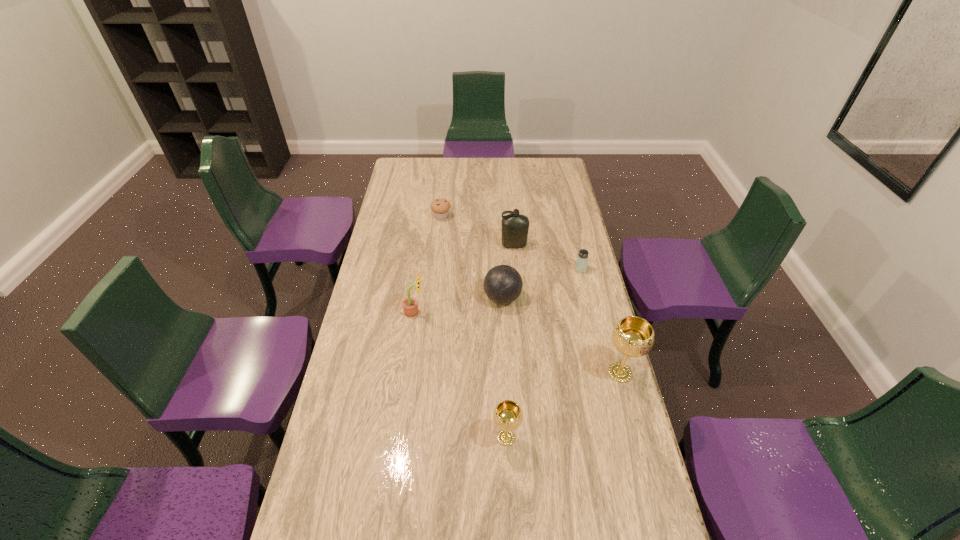
This screenshot has width=960, height=540. What are the coordinates of `vacant space at the far edge of the desktop` in the screenshot? It's located at (435, 167).

In the image, there is a desktop. Identify the location of free space at the left edge. (392, 369).

This screenshot has height=540, width=960. I want to click on vacant space at the right edge of the desktop, so click(593, 346).

The height and width of the screenshot is (540, 960). I want to click on free space at the far right corner of the desktop, so click(553, 179).

The height and width of the screenshot is (540, 960). Find the location of `vacant area between the farthest object and the farther chalice`. vacant area between the farthest object and the farther chalice is located at coordinates (531, 295).

Identify the location of free spot between the left chalice and the bowling ball. (504, 368).

Identify the location of free space that is in between the saltshaker and the shorter chalice. The height and width of the screenshot is (540, 960). (543, 353).

Where is `free space between the nearer chalice and the saltshaker`? The height and width of the screenshot is (540, 960). free space between the nearer chalice and the saltshaker is located at coordinates (543, 353).

You are a GUI agent. You are given a task and a screenshot of the screen. Output one action in this format:
    pyautogui.click(x=<x>, y=<y>)
    Task: Click on the empty space that is in between the sunflower and the bowling ball
    Image resolution: width=960 pixels, height=540 pixels.
    Given the screenshot: What is the action you would take?
    pyautogui.click(x=459, y=305)

What are the coordinates of `empty location between the tallest object and the sunflower` in the screenshot? It's located at (517, 342).